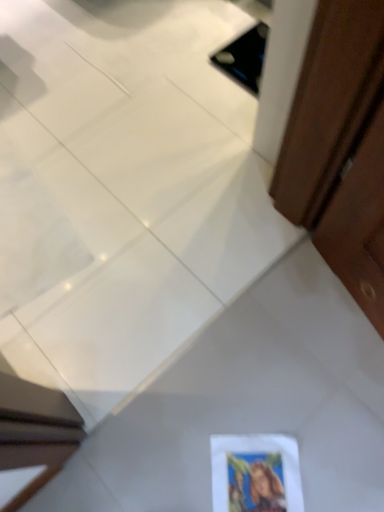
Identify the location of blank space situated above white paper postcard at lower center (from a real-world perspective). (259, 478).